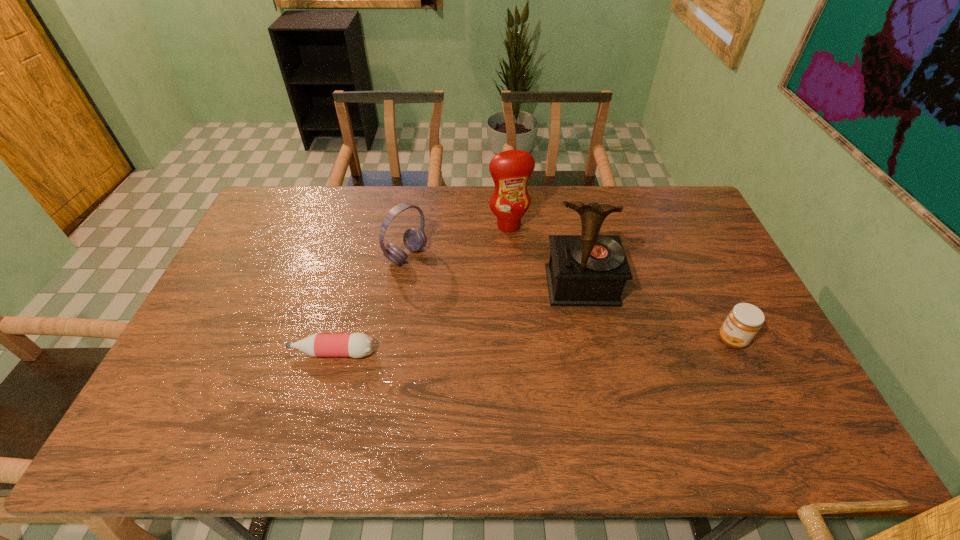
In order to click on vacant space located 0.230m with the cap open on the shortest object in this screenshot , I will do `click(203, 353)`.

This screenshot has width=960, height=540. Identify the location of free space located 0.340m on the front label of the fourth tallest object. (592, 340).

The width and height of the screenshot is (960, 540). What are the coordinates of `free location located on the front label of the fourth tallest object` in the screenshot? It's located at (618, 340).

You are a GUI agent. You are given a task and a screenshot of the screen. Output one action in this format:
    pyautogui.click(x=<x>, y=<y>)
    Task: Click on the free point located 0.300m on the front label of the fourth tallest object
    The width and height of the screenshot is (960, 540).
    Given the screenshot: What is the action you would take?
    pyautogui.click(x=607, y=340)

Where is `blank area located on the label side of the second tallest object`? Image resolution: width=960 pixels, height=540 pixels. blank area located on the label side of the second tallest object is located at coordinates (540, 309).

At what (x,y) coordinates should I click in order to perform the action: click on free location located on the label side of the second tallest object. Please return your answer as a coordinate pair (x, y). Image resolution: width=960 pixels, height=540 pixels. Looking at the image, I should click on (531, 282).

You are a GUI agent. You are given a task and a screenshot of the screen. Output one action in this format:
    pyautogui.click(x=<x>, y=<y>)
    Task: Click on the vacant space situated 0.400m on the label side of the second tallest object
    The width and height of the screenshot is (960, 540).
    Given the screenshot: What is the action you would take?
    pyautogui.click(x=546, y=326)

Locate an element on the screen. The width and height of the screenshot is (960, 540). vacant region located 0.190m on the headband and ear cups of the headset is located at coordinates (466, 294).

You are a GUI agent. You are given a task and a screenshot of the screen. Output one action in this format:
    pyautogui.click(x=<x>, y=<y>)
    Task: Click on the free space located 0.340m on the headband and ear cups of the headset
    This screenshot has width=960, height=540.
    Given the screenshot: What is the action you would take?
    pyautogui.click(x=506, y=319)

Where is `vacant space located 0.080m on the headband and ear cups of the headset`? Image resolution: width=960 pixels, height=540 pixels. vacant space located 0.080m on the headband and ear cups of the headset is located at coordinates (439, 276).